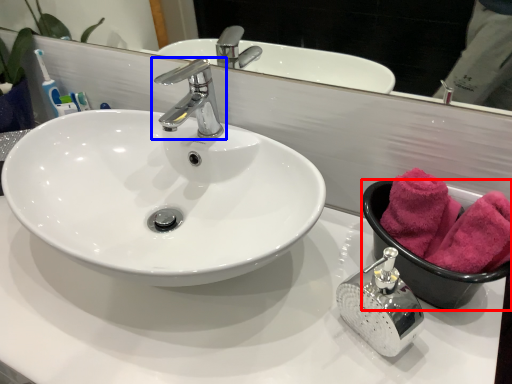
Question: Among these objects, which one is farthest to the camera, basin (highlighted by a red box) or tap (highlighted by a blue box)?

Choices:
 (A) basin
 (B) tap

Answer: (B)